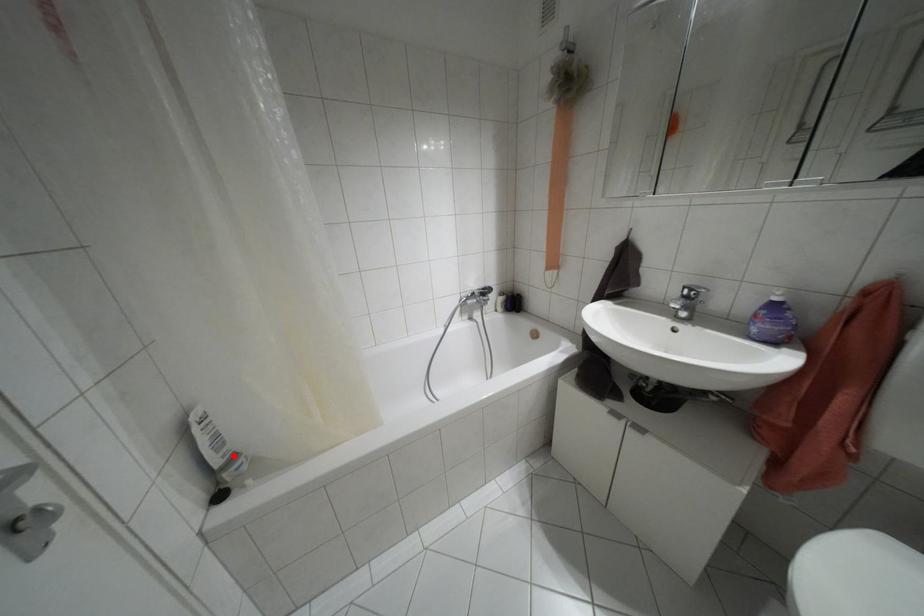
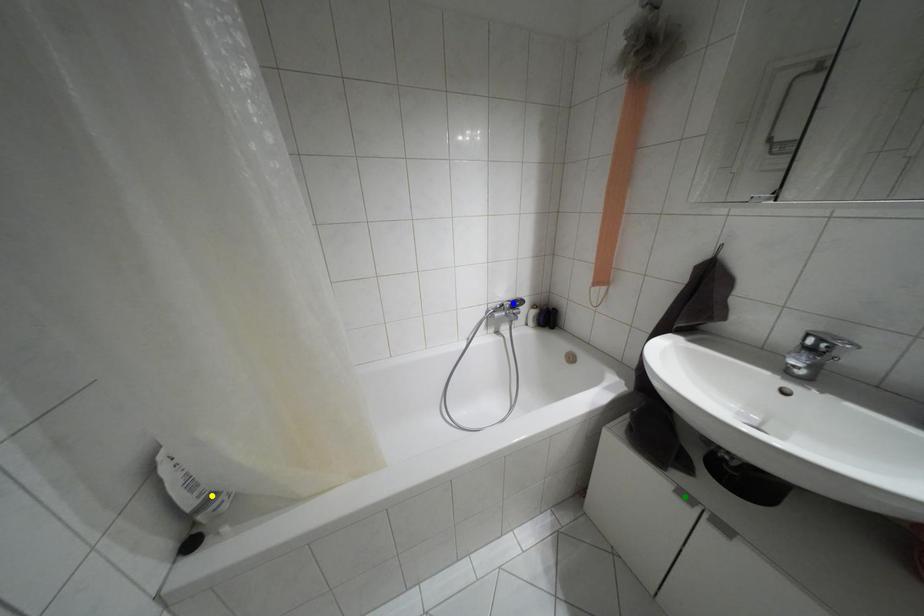
Question: I am providing you with two images of the same scene from different viewpoints. A red point is marked on the first image. You are given multiple points on the second image. Which point in image 2 represents the same 3d spot as the red point in image 1?

Choices:
 (A) blue point
 (B) yellow point
 (C) green point

Answer: (B)